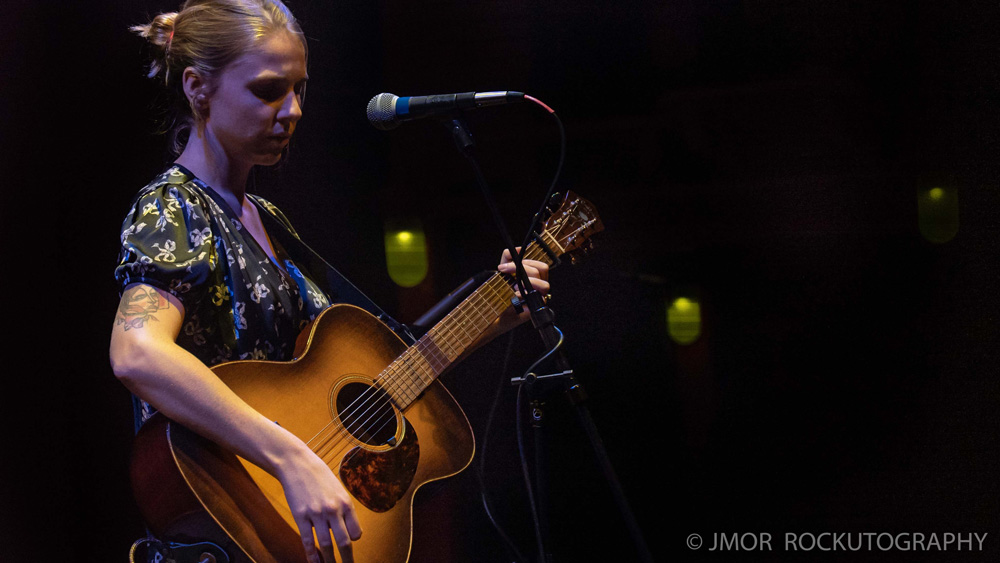
The height and width of the screenshot is (563, 1000). Identify the location of wires. [539, 361].